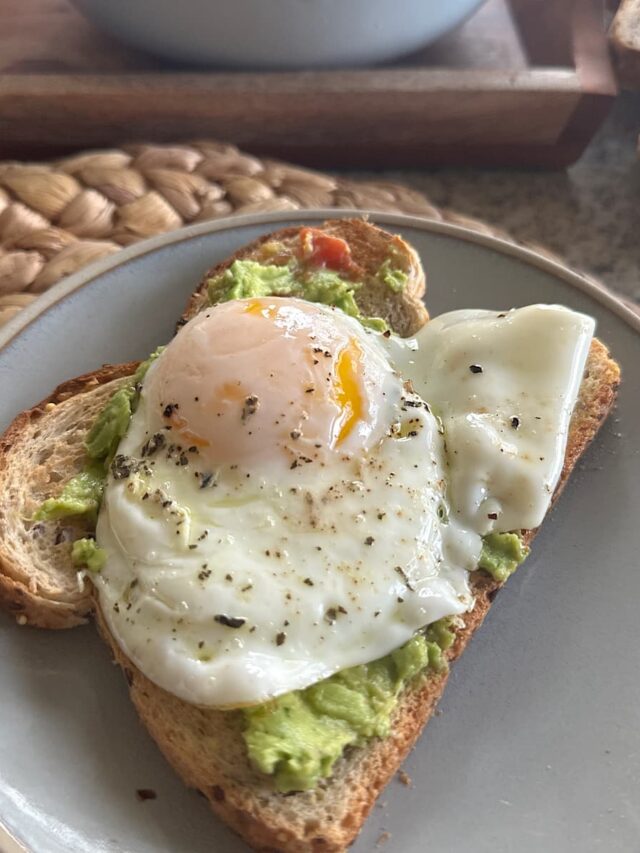
This screenshot has height=853, width=640. Find the location of `bowl`. bowl is located at coordinates (356, 26).